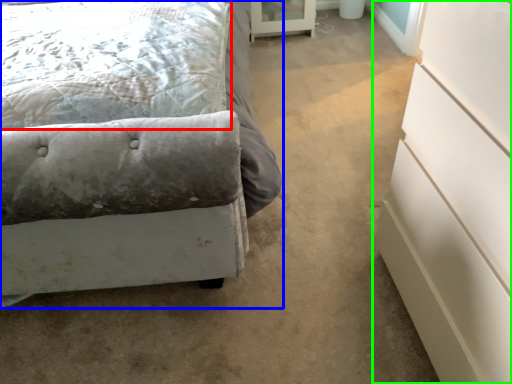
Question: Which is farther away from pillow (highlighted by a red box)? bed (highlighted by a blue box) or chest of drawers (highlighted by a green box)?

Choices:
 (A) bed
 (B) chest of drawers

Answer: (B)